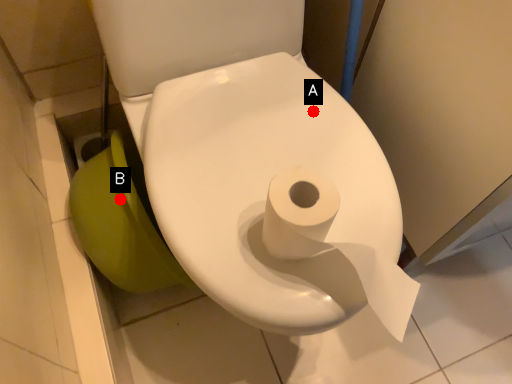
Question: Two points are circled on the image, labeled by A and B beside each circle. Which point is farther to the camera?

Choices:
 (A) A is further
 (B) B is further

Answer: (B)